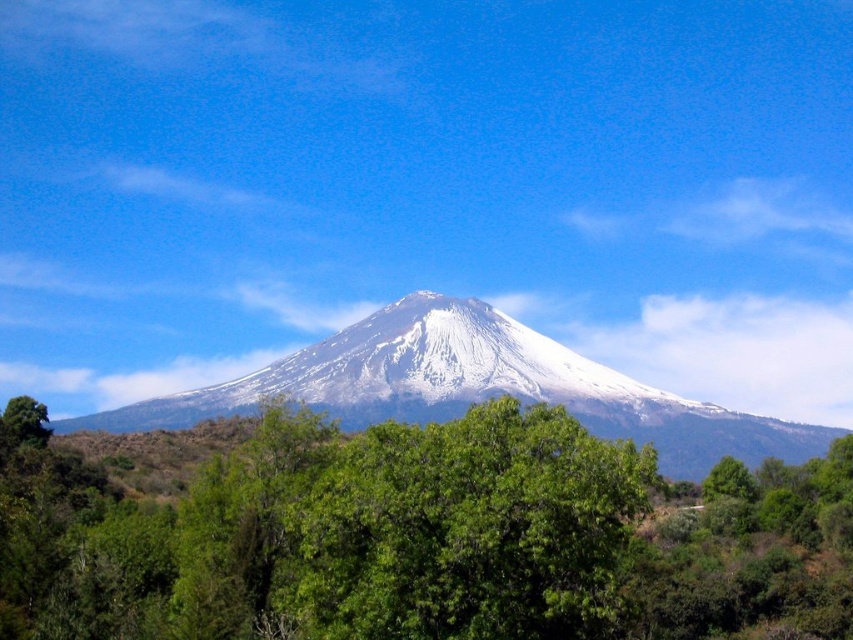
Which is below, green leafy tree at center or white snow-covered mountain at center?

green leafy tree at center is lower down.

Can you confirm if green leafy tree at center is wider than white snow-covered mountain at center?

No.

Does point (532, 429) lie in front of point (373, 323)?

Yes, it is in front of point (373, 323).

Where is `green leafy tree at center`? Image resolution: width=853 pixels, height=640 pixels. green leafy tree at center is located at coordinates (421, 538).